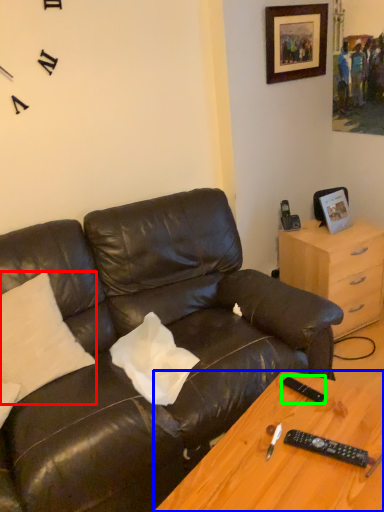
Question: Which is nearer to the pillow (highlighted by a red box)? desk (highlighted by a blue box) or remote (highlighted by a green box).

Choices:
 (A) desk
 (B) remote

Answer: (A)